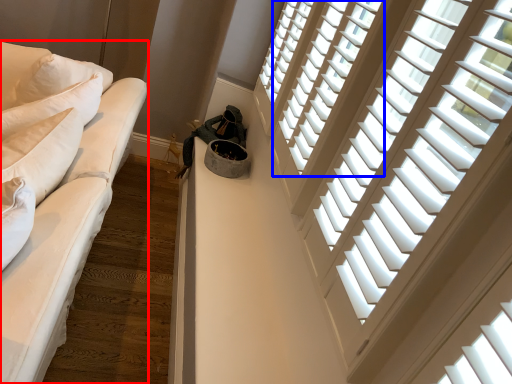
Question: Which object appears farthest to the camera in this image, studio couch (highlighted by a red box) or window (highlighted by a blue box)?

Choices:
 (A) studio couch
 (B) window

Answer: (B)